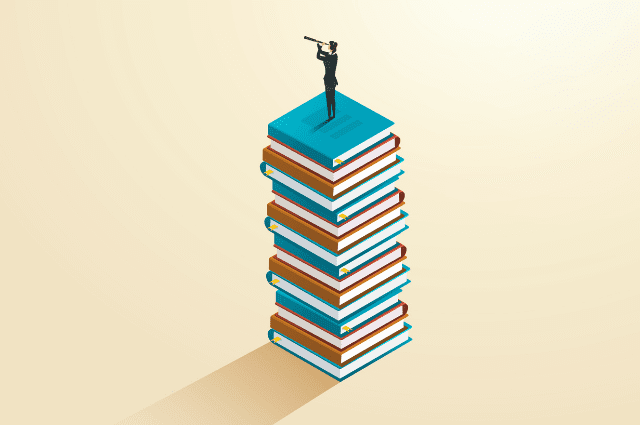
Identify the location of brown books. The width and height of the screenshot is (640, 425). (376, 156), (349, 180), (364, 230), (349, 281), (349, 302), (338, 343), (348, 357).